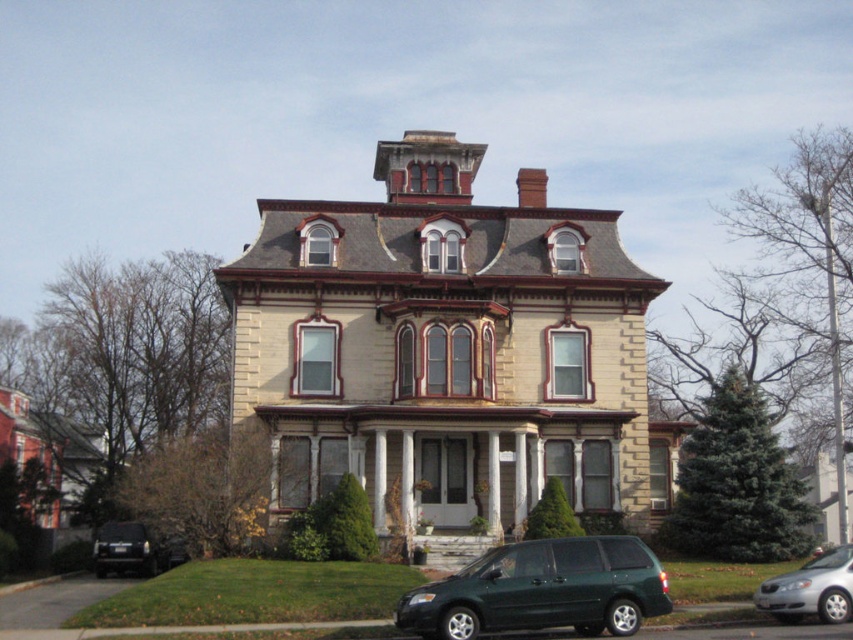
Question: Is green matte van at lower center above silver metallic sedan at lower right?

Choices:
 (A) yes
 (B) no

Answer: (B)

Question: Is green matte van at lower center below shiny black suv at lower left?

Choices:
 (A) no
 (B) yes

Answer: (A)

Question: From the image, what is the correct spatial relationship of green matte van at lower center in relation to silver metallic sedan at lower right?

Choices:
 (A) below
 (B) above

Answer: (A)

Question: Which of the following is the farthest from the observer?

Choices:
 (A) green matte van at lower center
 (B) shiny black suv at lower left
 (C) silver metallic sedan at lower right

Answer: (B)

Question: Which of these objects is positioned closest to the silver metallic sedan at lower right?

Choices:
 (A) green matte van at lower center
 (B) shiny black suv at lower left

Answer: (A)

Question: Which object is farther from the camera taking this photo?

Choices:
 (A) green matte van at lower center
 (B) silver metallic sedan at lower right
 (C) shiny black suv at lower left

Answer: (C)